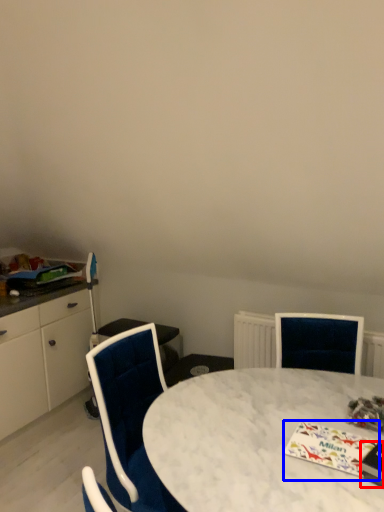
Question: Which object appears farthest to the camera in this image, magazine (highlighted by a red box) or magazine (highlighted by a blue box)?

Choices:
 (A) magazine
 (B) magazine

Answer: (B)